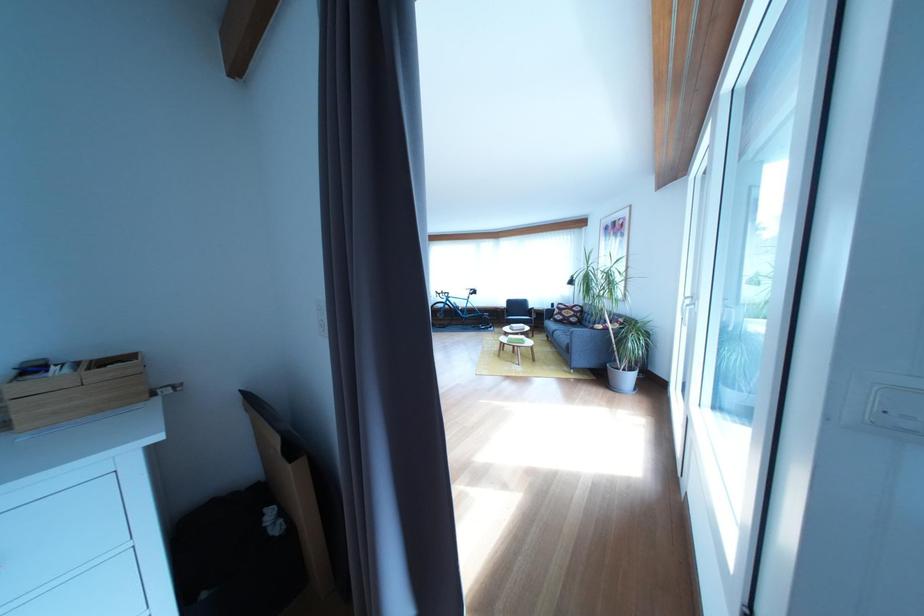
The height and width of the screenshot is (616, 924). What do you see at coordinates (609, 355) in the screenshot?
I see `a sofa sitting surface` at bounding box center [609, 355].